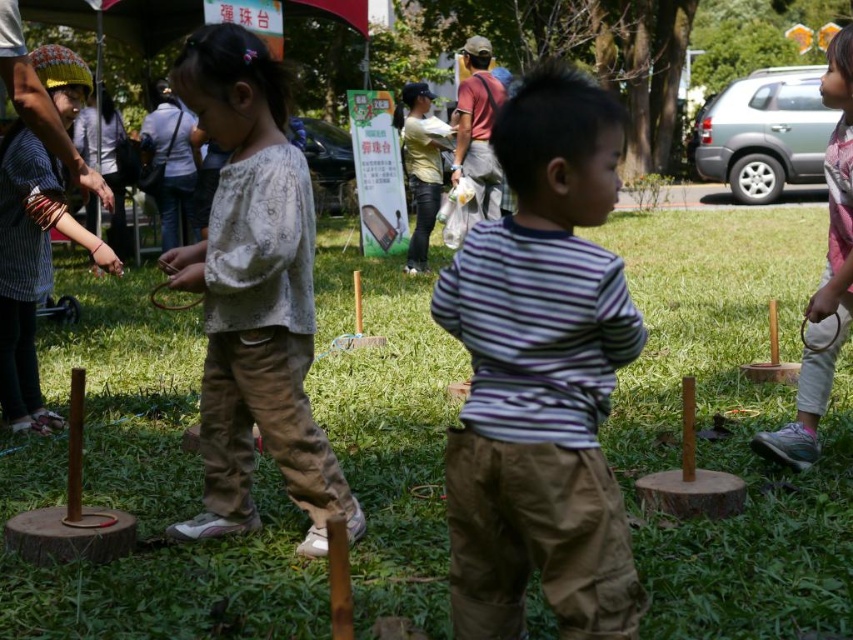
Question: Does green grass at center appear under light beige cotton shirt at center?

Choices:
 (A) yes
 (B) no

Answer: (A)

Question: Which point is farther from the camera taking this photo?

Choices:
 (A) (289, 224)
 (B) (554, 452)
 (C) (674, 324)

Answer: (C)

Question: Can you confirm if green grass at center is wider than light beige cotton shirt at center?

Choices:
 (A) yes
 (B) no

Answer: (A)

Question: Estimate the real-world distances between objects in this image. Which object is closer to the pink fabric shirt at right?

Choices:
 (A) striped cotton shirt at center
 (B) green grass at center

Answer: (A)

Question: In this image, where is striped cotton shirt at center located relative to light beige cotton shirt at center?

Choices:
 (A) right
 (B) left

Answer: (A)

Question: Among these objects, which one is farthest from the camera?

Choices:
 (A) striped cotton shirt at center
 (B) light beige cotton shirt at center

Answer: (B)